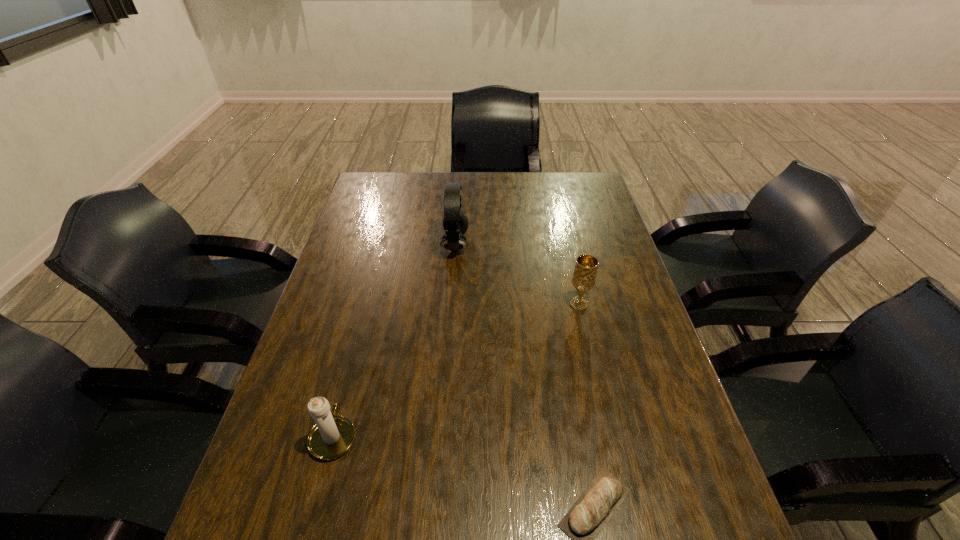
Where is `the second object from left to right`? This screenshot has height=540, width=960. the second object from left to right is located at coordinates [455, 223].

This screenshot has height=540, width=960. I want to click on earphone, so click(455, 223).

Locate an element on the screen. chalice is located at coordinates (584, 276).

Identify the location of the leftmost object. This screenshot has width=960, height=540. (332, 436).

Where is `candle holder`? This screenshot has width=960, height=540. candle holder is located at coordinates (332, 436).

In order to click on free location located on the ear cups of the tallest object in this screenshot , I will do `click(502, 245)`.

The image size is (960, 540). Find the location of `vacant space located 0.140m on the right of the chalice`. vacant space located 0.140m on the right of the chalice is located at coordinates (639, 304).

Locate an element on the screen. free region located on the handle side of the third farthest object is located at coordinates (364, 319).

The width and height of the screenshot is (960, 540). Identify the location of free spot located 0.100m on the handle side of the third farthest object. (349, 374).

Where is `vacant area situated 0.370m on the handle side of the third farthest object`? This screenshot has width=960, height=540. vacant area situated 0.370m on the handle side of the third farthest object is located at coordinates (371, 296).